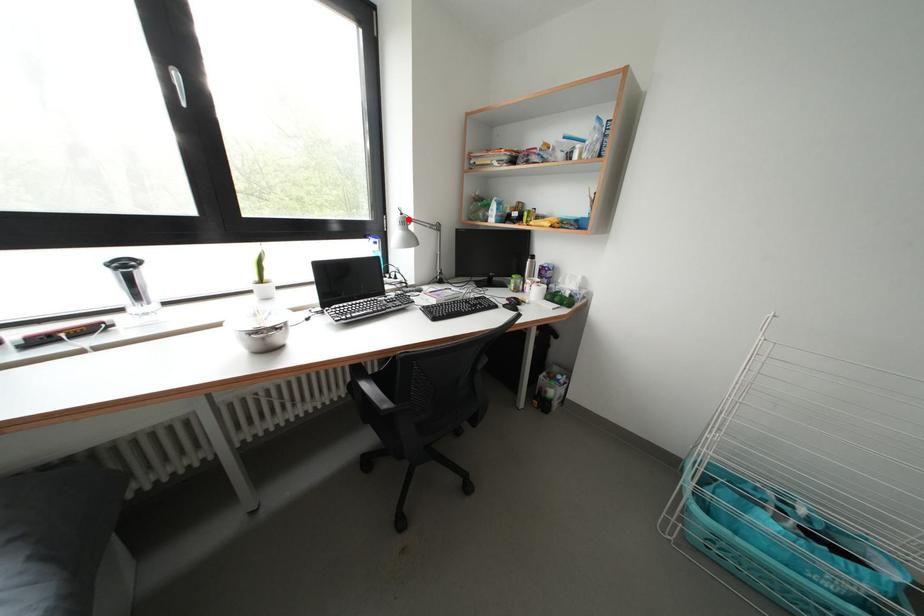
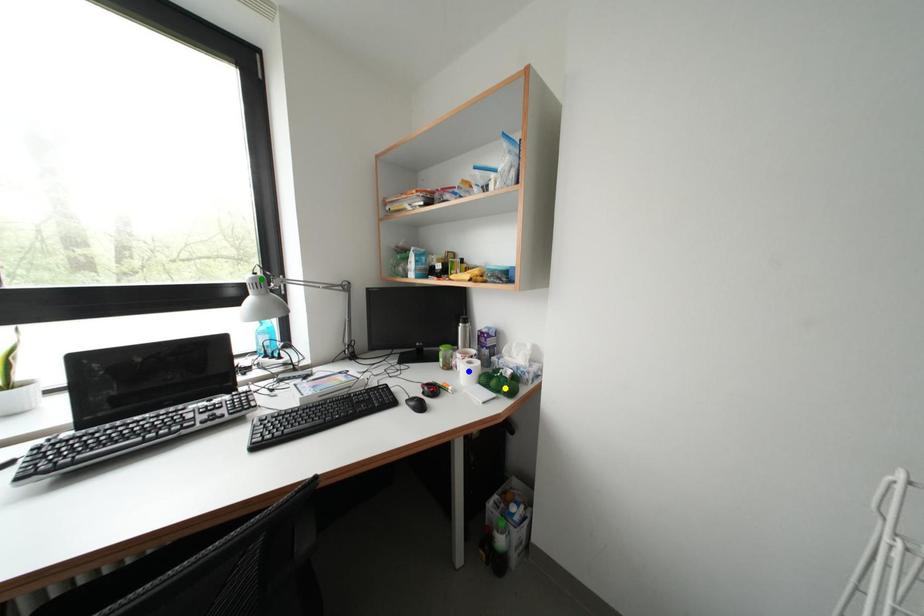
Question: I am providing you with two images of the same scene from different viewpoints. A red point is marked on the first image. You are given multiple points on the second image. Which point in image 2 is actually the same real-world point as the red point in image 1?

Choices:
 (A) yellow point
 (B) green point
 (C) blue point

Answer: (B)